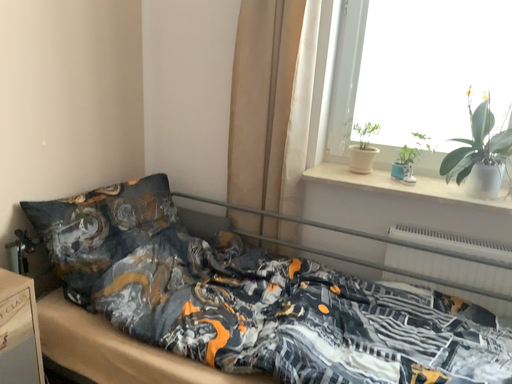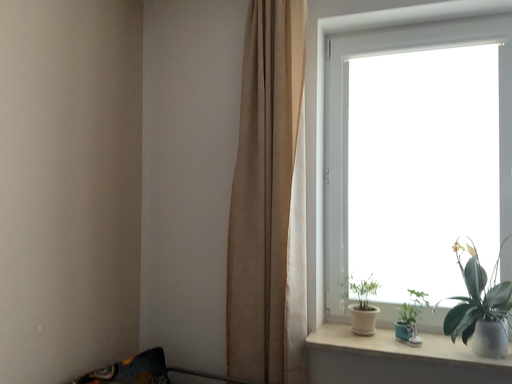
Question: Which way did the camera rotate in the video?

Choices:
 (A) rotated upward
 (B) rotated downward

Answer: (A)